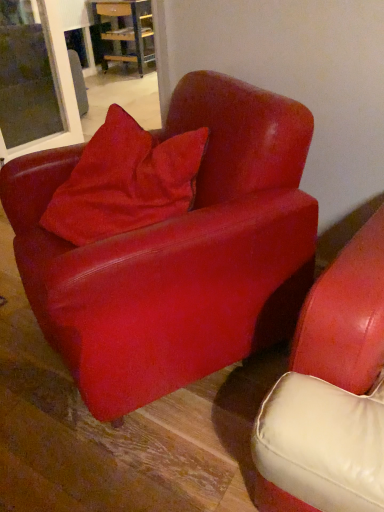
In order to click on velvet red pillow at center in this screenshot , I will do `click(125, 181)`.

Is point (128, 20) positioned behind point (263, 267)?

That is True.

Is wooden table at center wider than matte red armchair at center?

No, wooden table at center is not wider than matte red armchair at center.

Does wooden table at center have a greater height compared to matte red armchair at center?

In fact, wooden table at center may be shorter than matte red armchair at center.

From a real-world perspective, does wooden table at center stand above matte red armchair at center?

No, from a real-world perspective, wooden table at center is not over matte red armchair at center

From the image's perspective, is matte red armchair at center below velvet red pillow at center?

Indeed, from the image's perspective, matte red armchair at center is shown beneath velvet red pillow at center.

Can velvet red pillow at center be found inside matte red armchair at center?

Indeed, velvet red pillow at center is located within matte red armchair at center.

From a real-world perspective, is matte red armchair at center physically below velvet red pillow at center?

Yes, from a real-world perspective, matte red armchair at center is under velvet red pillow at center.

Does point (158, 322) appear closer or farther from the camera than point (128, 36)?

Clearly, point (158, 322) is closer to the camera than point (128, 36).

How many degrees apart are the facing directions of matte red armchair at center and wooden table at center?

The facing directions of matte red armchair at center and wooden table at center are 116 degrees apart.

From a real-world perspective, which is physically below, matte red armchair at center or wooden table at center?

wooden table at center, from a real-world perspective.

Are matte red armchair at center and wooden table at center located far from each other?

Yes, matte red armchair at center and wooden table at center are quite far apart.

Are velvet red pillow at center and matte red armchair at center located far from each other?

No, velvet red pillow at center is not far away from matte red armchair at center.

The height and width of the screenshot is (512, 384). In order to click on pillow behind the matte red armchair at center in this screenshot , I will do `click(125, 181)`.

From the picture: From the image's perspective, is velvet red pillow at center located above or below matte red armchair at center?

Based on their image positions, velvet red pillow at center is located above matte red armchair at center.

Which is correct: wooden table at center is inside velvet red pillow at center, or outside of it?

wooden table at center is located beyond the bounds of velvet red pillow at center.

From the image's perspective, is wooden table at center below velvet red pillow at center?

No.

Is wooden table at center facing towards velvet red pillow at center?

No.

Considering the relative positions of wooden table at center and velvet red pillow at center in the image provided, is wooden table at center behind velvet red pillow at center?

Yes, the depth of wooden table at center is greater than that of velvet red pillow at center.

The width and height of the screenshot is (384, 512). In the image, there is a transparent glass window at upper left. What are the coordinates of `table above it (from the image's perspective)` in the screenshot? It's located at (125, 32).

Does wooden table at center turn towards transparent glass window at upper left?

No, wooden table at center is not turned towards transparent glass window at upper left.

Is wooden table at center at the left side of transparent glass window at upper left?

In fact, wooden table at center is to the right of transparent glass window at upper left.

Does wooden table at center have a lesser height compared to transparent glass window at upper left?

Indeed, wooden table at center has a lesser height compared to transparent glass window at upper left.

Which of these two, transparent glass window at upper left or velvet red pillow at center, is smaller?

With smaller size is velvet red pillow at center.

Which is more to the right, transparent glass window at upper left or velvet red pillow at center?

Positioned to the right is velvet red pillow at center.

Is transparent glass window at upper left touching velvet red pillow at center?

transparent glass window at upper left is not next to velvet red pillow at center, and they're not touching.

Does transparent glass window at upper left have a greater height compared to velvet red pillow at center?

Yes.

This screenshot has width=384, height=512. I want to click on chair in front of the wooden table at center, so click(x=177, y=253).

Locate an element on the screen. Image resolution: width=384 pixels, height=512 pixels. chair below the velvet red pillow at center (from a real-world perspective) is located at coordinates (177, 253).

When comparing their distances from transparent glass window at upper left, does velvet red pillow at center or wooden table at center seem closer?

velvet red pillow at center is positioned closer to the anchor transparent glass window at upper left.

Considering their positions, is transparent glass window at upper left positioned further to matte red armchair at center than wooden table at center?

Among the two, wooden table at center is located further to matte red armchair at center.

Based on their spatial positions, is velvet red pillow at center or wooden table at center further from matte red armchair at center?

The object further to matte red armchair at center is wooden table at center.

Which object lies nearer to the anchor point wooden table at center, matte red armchair at center or velvet red pillow at center?

velvet red pillow at center is positioned closer to the anchor wooden table at center.

Considering their positions, is velvet red pillow at center positioned closer to matte red armchair at center than transparent glass window at upper left?

velvet red pillow at center.

Based on their spatial positions, is wooden table at center or matte red armchair at center closer to transparent glass window at upper left?

matte red armchair at center is closer to transparent glass window at upper left.

In the scene shown: When comparing their distances from velvet red pillow at center, does wooden table at center or transparent glass window at upper left seem further?

wooden table at center.

From the image, which object appears to be farther from wooden table at center, transparent glass window at upper left or matte red armchair at center?

matte red armchair at center is positioned further to the anchor wooden table at center.

This screenshot has width=384, height=512. I want to click on window between matte red armchair at center and wooden table at center from front to back, so click(x=36, y=85).

The image size is (384, 512). What are the coordinates of `window located between velvet red pillow at center and wooden table at center in the depth direction` in the screenshot? It's located at (36, 85).

This screenshot has width=384, height=512. What are the coordinates of `pillow between matte red armchair at center and transparent glass window at upper left from front to back` in the screenshot? It's located at (125, 181).

Find the location of `pillow between matte red armchair at center and wooden table at center from front to back`. pillow between matte red armchair at center and wooden table at center from front to back is located at coordinates (125, 181).